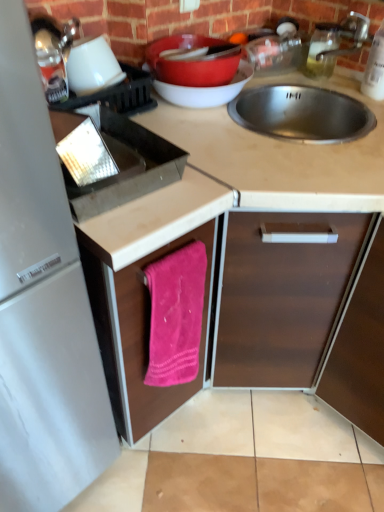
Identify the location of white matte cup at upper left, the second appliance viewed from the left. (92, 66).

I want to click on smooth beige countertop at center, so click(280, 156).

This screenshot has width=384, height=512. I want to click on clear glass bottle at upper right, the 1th bottle when ordered from left to right, so click(x=322, y=50).

What is the approximate height of pink fabric towel at lower center, marked as the 1th cabinetry in a left-to-right arrangement?

pink fabric towel at lower center, marked as the 1th cabinetry in a left-to-right arrangement, is 41.87 centimeters tall.

Where is `matte brown countertop at center`? This screenshot has height=512, width=384. matte brown countertop at center is located at coordinates (241, 251).

Locate an element on the screen. This screenshot has height=512, width=384. clear plastic bottle at upper right, acting as the 2th bottle starting from the left is located at coordinates (375, 68).

Is matte brown countertop at center facing towards clear plastic bottle at upper right, arranged as the 1th bottle when viewed from the right?

No.

Considering the relative sizes of matte brown countertop at center and clear plastic bottle at upper right, the second bottle positioned from the back, in the image provided, is matte brown countertop at center thinner than clear plastic bottle at upper right, the second bottle positioned from the back,?

No, matte brown countertop at center is not thinner than clear plastic bottle at upper right, the second bottle positioned from the back.

Considering the positions of points (256, 312) and (369, 90), is point (256, 312) farther from camera compared to point (369, 90)?

No, it is in front of (369, 90).

Is clear plastic bottle at upper right, acting as the 2th bottle starting from the left, bigger or smaller than matte red bowl at upper center?

Considering their sizes, clear plastic bottle at upper right, acting as the 2th bottle starting from the left, takes up less space than matte red bowl at upper center.

Can you tell me how much clear plastic bottle at upper right, acting as the 2th bottle starting from the left, and matte red bowl at upper center differ in facing direction?

The angular difference between clear plastic bottle at upper right, acting as the 2th bottle starting from the left, and matte red bowl at upper center is 85.3 degrees.

From a real-world perspective, is clear plastic bottle at upper right, the second bottle positioned from the back, below matte red bowl at upper center?

Actually, clear plastic bottle at upper right, the second bottle positioned from the back, is physically above matte red bowl at upper center in the real world.

Is clear plastic bottle at upper right, the second bottle positioned from the back, thinner than matte red bowl at upper center?

Yes.

Looking at their sizes, would you say white matte cup at upper left, which ranks as the 1th appliance in right-to-left order, is wider or thinner than silver metallic faucet at upper right?

Clearly, white matte cup at upper left, which ranks as the 1th appliance in right-to-left order, has less width compared to silver metallic faucet at upper right.

Is white matte cup at upper left, the second appliance viewed from the left, in contact with silver metallic faucet at upper right?

There is a gap between white matte cup at upper left, the second appliance viewed from the left, and silver metallic faucet at upper right.

Can you tell me how much white matte cup at upper left, which ranks as the 1th appliance in right-to-left order, and silver metallic faucet at upper right differ in facing direction?

The angle between the facing direction of white matte cup at upper left, which ranks as the 1th appliance in right-to-left order, and the facing direction of silver metallic faucet at upper right is 82.7 degrees.

Can we say white matte cup at upper left, the second appliance viewed from the left, lies outside silver metallic faucet at upper right?

That's correct, white matte cup at upper left, the second appliance viewed from the left, is outside of silver metallic faucet at upper right.

Which is closer, (375,79) or (350,377)?

Point (375,79) is farther from the camera than point (350,377).

In the scene shown: Can you confirm if clear plastic bottle at upper right, arranged as the 1th bottle when viewed from the right, is positioned to the left of brown matte cabinet at center, the first cabinetry viewed from the right?

Correct, you'll find clear plastic bottle at upper right, arranged as the 1th bottle when viewed from the right, to the left of brown matte cabinet at center, the first cabinetry viewed from the right.

Is clear plastic bottle at upper right, the second bottle positioned from the back, aimed at brown matte cabinet at center, the first cabinetry viewed from the right?

No, clear plastic bottle at upper right, the second bottle positioned from the back, is not turned towards brown matte cabinet at center, the first cabinetry viewed from the right.

Considering the relative positions of clear plastic bottle at upper right, acting as the 2th bottle starting from the left, and brown matte cabinet at center, the first cabinetry viewed from the right, in the image provided, is clear plastic bottle at upper right, acting as the 2th bottle starting from the left, in front of brown matte cabinet at center, the first cabinetry viewed from the right,?

No.

Locate an element on the screen. The height and width of the screenshot is (512, 384). basin above the matte brown countertop at center (from a real-world perspective) is located at coordinates (191, 62).

Considering the positions of point (155, 58) and point (129, 439), is point (155, 58) closer or farther from the camera than point (129, 439)?

Point (155, 58) is closer to the camera than point (129, 439).

Is matte red bowl at upper center turned away from matte brown countertop at center?

No.

Which object is thinner, white matte cup at upper left, which ranks as the 1th appliance in right-to-left order, or clear glass bottle at upper right, which is the 2th bottle from right to left?

clear glass bottle at upper right, which is the 2th bottle from right to left.

Is white matte cup at upper left, the second appliance viewed from the left, inside the boundaries of clear glass bottle at upper right, the 1th bottle when ordered from left to right, or outside?

white matte cup at upper left, the second appliance viewed from the left, is outside clear glass bottle at upper right, the 1th bottle when ordered from left to right.

Can you tell me how much white matte cup at upper left, which ranks as the 1th appliance in right-to-left order, and clear glass bottle at upper right, the 1th bottle when ordered from left to right, differ in facing direction?

There is a 47.6-degree angle between the facing directions of white matte cup at upper left, which ranks as the 1th appliance in right-to-left order, and clear glass bottle at upper right, the 1th bottle when ordered from left to right.

In terms of height, does white matte cup at upper left, which ranks as the 1th appliance in right-to-left order, look taller or shorter compared to clear glass bottle at upper right, the 2th bottle viewed from the front?

In the image, white matte cup at upper left, which ranks as the 1th appliance in right-to-left order, appears to be shorter than clear glass bottle at upper right, the 2th bottle viewed from the front.

Is matte brown countertop at center far from clear glass bottle at upper right, the 2th bottle viewed from the front?

Actually, matte brown countertop at center and clear glass bottle at upper right, the 2th bottle viewed from the front, are a little close together.

Based on the photo, which object is further away from the camera taking this photo, matte brown countertop at center or clear glass bottle at upper right, arranged as the first bottle when viewed from the back?

Positioned behind is clear glass bottle at upper right, arranged as the first bottle when viewed from the back.

Based on their sizes in the image, would you say matte brown countertop at center is bigger or smaller than clear glass bottle at upper right, the 2th bottle viewed from the front?

matte brown countertop at center is bigger than clear glass bottle at upper right, the 2th bottle viewed from the front.

From the image's perspective, is matte brown countertop at center over clear glass bottle at upper right, which is the 2th bottle from right to left?

No, from the image's perspective, matte brown countertop at center is not over clear glass bottle at upper right, which is the 2th bottle from right to left.

Find the location of a particular element. The height and width of the screenshot is (512, 384). the 2nd bottle to the right when counting from the matte brown countertop at center is located at coordinates (375, 68).

This screenshot has width=384, height=512. In order to click on basin in front of the clear plastic bottle at upper right, arranged as the 1th bottle when viewed from the right in this screenshot , I will do `click(191, 62)`.

Estimate the real-world distances between objects in this image. Which object is closer to matte brown countertop at center, smooth beige countertop at center or metallic silver kettle at upper left, the 1th appliance from the left?

smooth beige countertop at center.

Considering their positions, is clear plastic bottle at upper right, acting as the 2th bottle starting from the left, positioned closer to matte red bowl at upper center than silver metallic faucet at upper right?

silver metallic faucet at upper right is positioned closer to the anchor matte red bowl at upper center.

From the picture: When comparing their distances from metallic silver kettle at upper left, the 2th appliance in the right-to-left sequence, does pink fabric towel at lower center, marked as the 1th cabinetry in a left-to-right arrangement, or silver metallic faucet at upper right seem closer?

Among the two, pink fabric towel at lower center, marked as the 1th cabinetry in a left-to-right arrangement, is located nearer to metallic silver kettle at upper left, the 2th appliance in the right-to-left sequence.

Considering their positions, is white matte cup at upper left, the second appliance viewed from the left, positioned further to pink fabric towel at lower center, marked as the 1th cabinetry in a left-to-right arrangement, than silver metallic faucet at upper right?

The object further to pink fabric towel at lower center, marked as the 1th cabinetry in a left-to-right arrangement, is silver metallic faucet at upper right.

Which object lies nearer to the anchor point pink fabric towel at lower center, marked as the 1th cabinetry in a left-to-right arrangement, white matte cup at upper left, which ranks as the 1th appliance in right-to-left order, or clear glass bottle at upper right, the 2th bottle viewed from the front?

white matte cup at upper left, which ranks as the 1th appliance in right-to-left order, is closer to pink fabric towel at lower center, marked as the 1th cabinetry in a left-to-right arrangement.

From the image, which object appears to be farther from pink fabric towel at lower center, marked as the 1th cabinetry in a left-to-right arrangement, matte red bowl at upper center or clear plastic bottle at upper right, the 1th bottle in the front-to-back sequence?

The object further to pink fabric towel at lower center, marked as the 1th cabinetry in a left-to-right arrangement, is clear plastic bottle at upper right, the 1th bottle in the front-to-back sequence.

Considering their positions, is matte brown countertop at center positioned closer to white matte cup at upper left, the second appliance viewed from the left, than pink fabric towel at lower center, which is the second cabinetry in right-to-left order?

matte brown countertop at center is closer to white matte cup at upper left, the second appliance viewed from the left.

From the image, which object appears to be farther from pink fabric towel at lower center, which is the second cabinetry in right-to-left order, matte red bowl at upper center or silver metallic faucet at upper right?

Among the two, silver metallic faucet at upper right is located further to pink fabric towel at lower center, which is the second cabinetry in right-to-left order.

At what (x,y) coordinates should I click in order to perform the action: click on faucet between clear glass bottle at upper right, which is the 2th bottle from right to left, and matte brown countertop at center vertically. Please return your answer as a coordinate pair (x, y). The image size is (384, 512). Looking at the image, I should click on (342, 36).

Find the location of `faucet between clear glass bottle at upper right, arranged as the first bottle when viewed from the back, and pink fabric towel at lower center, which is the second cabinetry in right-to-left order, in the up-down direction`. faucet between clear glass bottle at upper right, arranged as the first bottle when viewed from the back, and pink fabric towel at lower center, which is the second cabinetry in right-to-left order, in the up-down direction is located at coordinates (342, 36).

Image resolution: width=384 pixels, height=512 pixels. What are the coordinates of `basin between white matte cup at upper left, which ranks as the 1th appliance in right-to-left order, and silver metallic faucet at upper right, in the horizontal direction` in the screenshot? It's located at (191, 62).

Find the location of `countertop between clear glass bottle at upper right, which is the 2th bottle from right to left, and pink fabric towel at lower center, marked as the 1th cabinetry in a left-to-right arrangement, from top to bottom`. countertop between clear glass bottle at upper right, which is the 2th bottle from right to left, and pink fabric towel at lower center, marked as the 1th cabinetry in a left-to-right arrangement, from top to bottom is located at coordinates (241, 251).